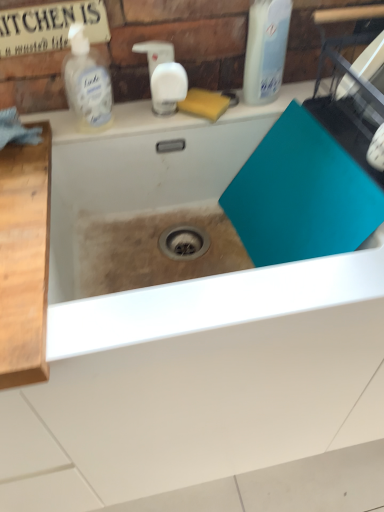
Question: Is teal matte cutting board at center shorter than clear plastic bottle at upper left, marked as the second cleaning product in a right-to-left arrangement?

Choices:
 (A) yes
 (B) no

Answer: (B)

Question: Is teal matte cutting board at center positioned behind clear plastic bottle at upper left, positioned as the first cleaning product in left-to-right order?

Choices:
 (A) yes
 (B) no

Answer: (B)

Question: Considering the relative sizes of teal matte cutting board at center and clear plastic bottle at upper left, positioned as the first cleaning product in left-to-right order, in the image provided, is teal matte cutting board at center bigger than clear plastic bottle at upper left, positioned as the first cleaning product in left-to-right order,?

Choices:
 (A) no
 (B) yes

Answer: (B)

Question: Does teal matte cutting board at center have a greater width compared to clear plastic bottle at upper left, marked as the second cleaning product in a right-to-left arrangement?

Choices:
 (A) yes
 (B) no

Answer: (A)

Question: Is teal matte cutting board at center next to clear plastic bottle at upper left, positioned as the first cleaning product in left-to-right order, and touching it?

Choices:
 (A) yes
 (B) no

Answer: (B)

Question: Is teal matte cutting board at center facing away from clear plastic bottle at upper left, positioned as the first cleaning product in left-to-right order?

Choices:
 (A) yes
 (B) no

Answer: (B)

Question: Could you tell me if clear plastic bottle at upper left, marked as the second cleaning product in a right-to-left arrangement, is turned towards teal matte cutting board at center?

Choices:
 (A) yes
 (B) no

Answer: (B)

Question: Considering the relative sizes of clear plastic bottle at upper left, marked as the second cleaning product in a right-to-left arrangement, and teal matte cutting board at center in the image provided, is clear plastic bottle at upper left, marked as the second cleaning product in a right-to-left arrangement, taller than teal matte cutting board at center?

Choices:
 (A) yes
 (B) no

Answer: (B)

Question: Is clear plastic bottle at upper left, positioned as the first cleaning product in left-to-right order, positioned with its back to teal matte cutting board at center?

Choices:
 (A) no
 (B) yes

Answer: (A)

Question: Is the depth of clear plastic bottle at upper left, positioned as the first cleaning product in left-to-right order, greater than that of teal matte cutting board at center?

Choices:
 (A) no
 (B) yes

Answer: (B)

Question: Is clear plastic bottle at upper left, marked as the second cleaning product in a right-to-left arrangement, far away from teal matte cutting board at center?

Choices:
 (A) yes
 (B) no

Answer: (B)

Question: Would you say clear plastic bottle at upper left, positioned as the first cleaning product in left-to-right order, contains teal matte cutting board at center?

Choices:
 (A) no
 (B) yes

Answer: (A)

Question: Does teal matte cutting board at center come behind translucent plastic bottle at upper right, which is the first cleaning product from right to left?

Choices:
 (A) yes
 (B) no

Answer: (B)